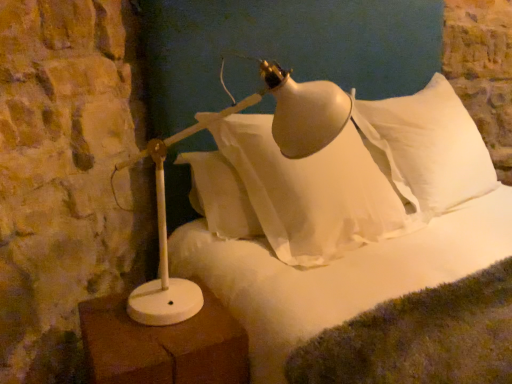
Question: Would you say white soft pillow at upper right is to the left or to the right of white fluffy bed at center in the picture?

Choices:
 (A) left
 (B) right

Answer: (B)

Question: From a real-world perspective, is white soft pillow at upper right positioned above or below white fluffy bed at center?

Choices:
 (A) below
 (B) above

Answer: (A)

Question: Which object is the farthest from the white fluffy bed at center?

Choices:
 (A) white soft pillow at upper right
 (B) white matte lamp at left
 (C) white matte table lamp at lower left

Answer: (B)

Question: Estimate the real-world distances between objects in this image. Which object is farther from the white matte table lamp at lower left?

Choices:
 (A) white fluffy bed at center
 (B) white soft pillow at upper right
 (C) white matte lamp at left

Answer: (B)